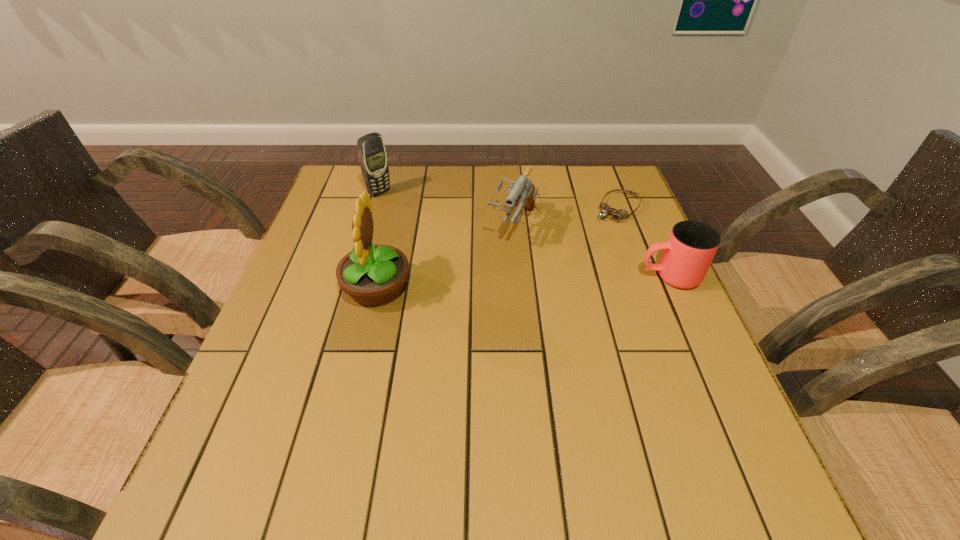
At what (x,y) coordinates should I click in order to perform the action: click on vacant spot on the desktop that is between the sunflower and the fourth tallest object and is positioned on the front lenses and sides of the goggles. Please return your answer as a coordinate pair (x, y). This screenshot has width=960, height=540. Looking at the image, I should click on (561, 281).

I want to click on vacant space on the desktop that is between the sunflower and the fourth tallest object and is positioned at the barrel end of the gun, so click(x=484, y=284).

Find the location of a particular element. vacant space on the desktop that is between the tallest object and the cup and is positioned on the front face of the cellular telephone is located at coordinates (508, 282).